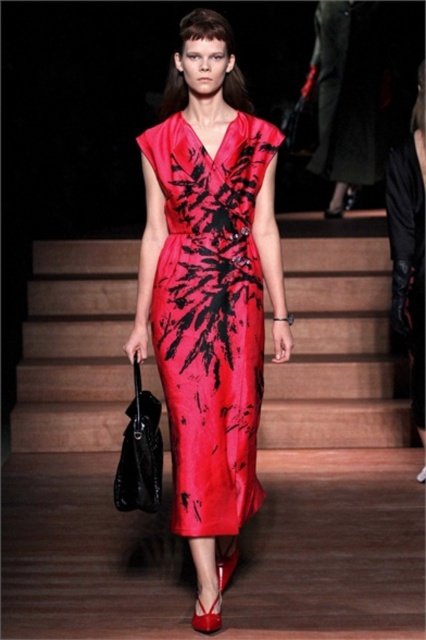
You are a photographer at the runway show and need to capture a closeup of the shiny silk dress at center while avoiding the satin stairs at center in the background. Is the dress large enough to fill the frame without the stairs appearing?

The satin stairs at center is larger in size than shiny silk dress at center. Therefore, the dress may not fill the frame completely, and the stairs could still appear in the background.

You are a photographer standing at the runway entrance. You want to take a closeup shot of the shiny silk dress at center. The camera you have can focus up to 3 meters. Will you be able to capture the dress clearly?

The shiny silk dress at center is 3.01 meters away from the viewer. Since the camera can focus up to 3 meters, the dress is slightly beyond the camera range, so you won generated.

You are a photographer at a fashion show and need to capture both the shiny silk dress at center and the silky black dress at right in a single shot. Based on their positions, which dress should you focus on first to ensure both are in frame?

The shiny silk dress at center is positioned on the left side of silky black dress at right, so focusing on the center dress first will allow you to frame both dresses as they are aligned horizontally from left to right.